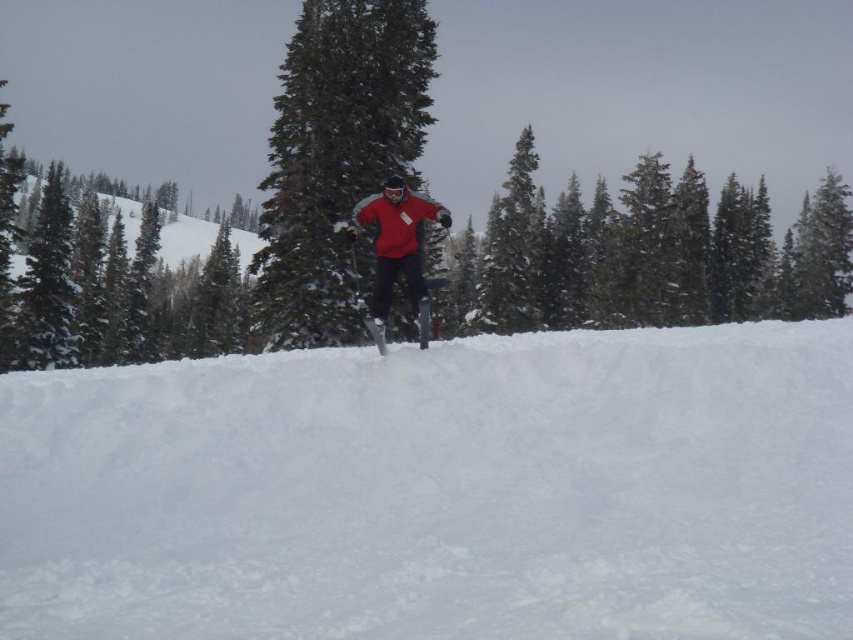
Does white fluffy snow at center appear on the right side of green textured pine tree at center?

Indeed, white fluffy snow at center is positioned on the right side of green textured pine tree at center.

Looking at this image, does white fluffy snow at center lie behind green textured pine tree at center?

That is False.

Describe the element at coordinates (439, 490) in the screenshot. This screenshot has width=853, height=640. I see `white fluffy snow at center` at that location.

Find the location of a particular element. This screenshot has height=640, width=853. white fluffy snow at center is located at coordinates (439, 490).

Is green textured pine tree at center closer to the viewer compared to matte red snowboarder at center?

No, green textured pine tree at center is further to the viewer.

Is green textured pine tree at center smaller than matte red snowboarder at center?

No, green textured pine tree at center is not smaller than matte red snowboarder at center.

What are the coordinates of `green textured pine tree at center` in the screenshot? It's located at (335, 161).

Can you confirm if green textured pine tree at center is positioned above matte black ski at center?

Yes, green textured pine tree at center is above matte black ski at center.

Is point (387, 13) positioned after point (427, 314)?

Yes, point (387, 13) is behind point (427, 314).

Is point (373, 12) positioned behind point (379, 352)?

Yes, it is.

At what (x,y) coordinates should I click in order to perform the action: click on green textured pine tree at center. Please return your answer as a coordinate pair (x, y). The image size is (853, 640). Looking at the image, I should click on (335, 161).